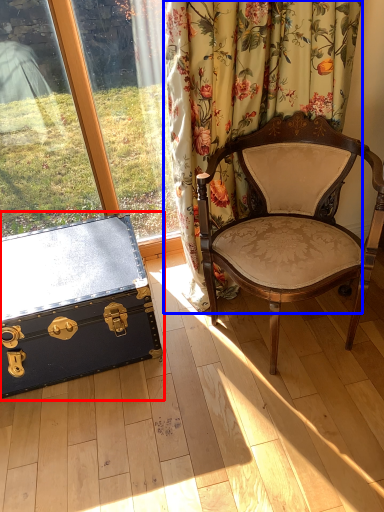
Question: Which object appears farthest to the camera in this image, box (highlighted by a red box) or curtain (highlighted by a blue box)?

Choices:
 (A) box
 (B) curtain

Answer: (A)